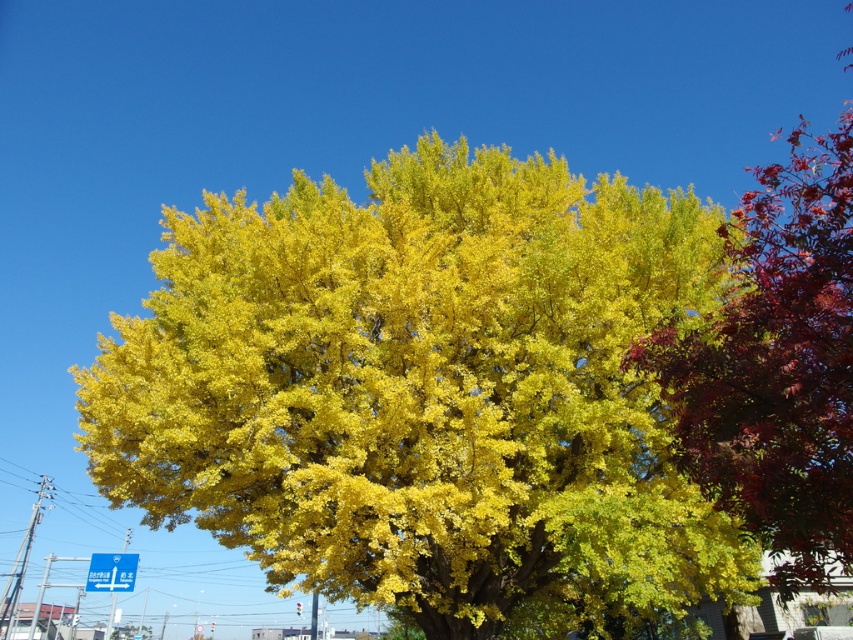
Question: Which of the following is the farthest from the observer?

Choices:
 (A) shiny red leaves at upper right
 (B) golden yellow leaves at center

Answer: (B)

Question: Can you confirm if golden yellow leaves at center is positioned below shiny red leaves at upper right?

Choices:
 (A) yes
 (B) no

Answer: (A)

Question: Which point is closer to the camera?

Choices:
 (A) (825, 547)
 (B) (654, 264)

Answer: (A)

Question: Where is golden yellow leaves at center located in relation to shiny red leaves at upper right in the image?

Choices:
 (A) above
 (B) below

Answer: (B)

Question: Which point is farther to the camera?

Choices:
 (A) golden yellow leaves at center
 (B) shiny red leaves at upper right

Answer: (A)

Question: Can you confirm if golden yellow leaves at center is thinner than shiny red leaves at upper right?

Choices:
 (A) yes
 (B) no

Answer: (A)